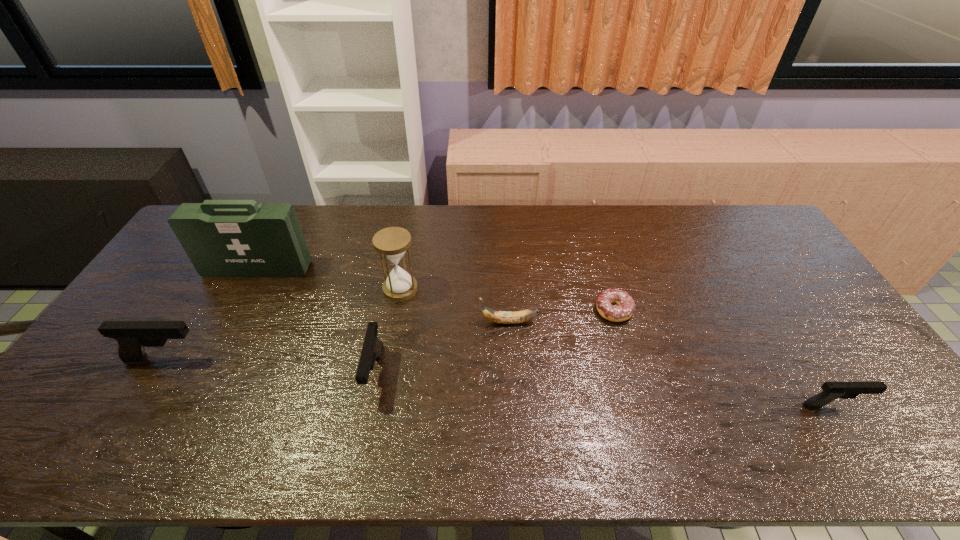
Where is `the tallest pistol`? This screenshot has width=960, height=540. the tallest pistol is located at coordinates (132, 337).

This screenshot has width=960, height=540. What are the coordinates of `the fifth shortest object` in the screenshot? It's located at (132, 337).

Identify the location of the second tallest pistol. This screenshot has height=540, width=960. (372, 349).

I want to click on the fourth shortest object, so click(x=372, y=349).

Locate an element on the screen. The image size is (960, 540). the rightmost object is located at coordinates (831, 391).

Locate an element on the screen. This screenshot has height=540, width=960. the shortest pistol is located at coordinates (831, 391).

Locate an element on the screen. This screenshot has height=540, width=960. hourglass is located at coordinates (392, 243).

You are a GUI agent. You are given a task and a screenshot of the screen. Output one action in this format:
    pyautogui.click(x=<x>, y=<y>)
    Task: Click on the sixth object from left to right
    This screenshot has height=540, width=960.
    Given the screenshot: What is the action you would take?
    pyautogui.click(x=625, y=307)

Identify the location of doughnut. Image resolution: width=960 pixels, height=540 pixels. (625, 307).

Where is `the tallest object`? The width and height of the screenshot is (960, 540). the tallest object is located at coordinates (223, 238).